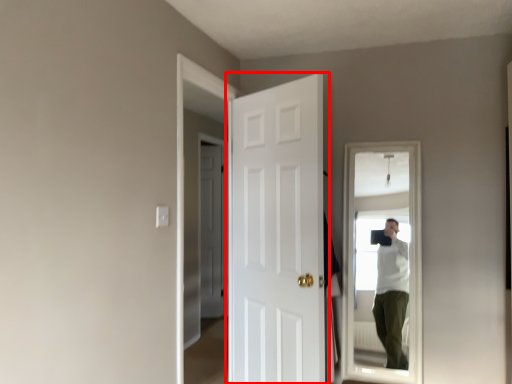
Question: Considering the relative positions of door (annotated by the red box) and door in the image provided, where is door (annotated by the red box) located with respect to the staircase?

Choices:
 (A) right
 (B) left

Answer: (A)